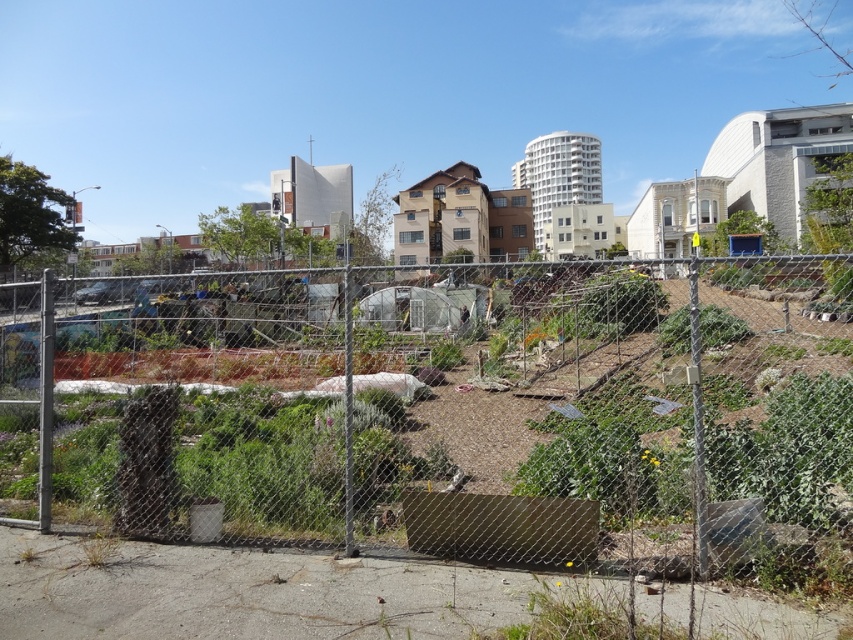
Between metal mesh fence at center and green leafy plant at center, which one is positioned higher?

metal mesh fence at center

Which is below, metal mesh fence at center or green leafy plant at center?

green leafy plant at center is lower down.

Who is more forward, (828, 468) or (672, 321)?

Positioned in front is point (828, 468).

This screenshot has width=853, height=640. I want to click on metal mesh fence at center, so (451, 413).